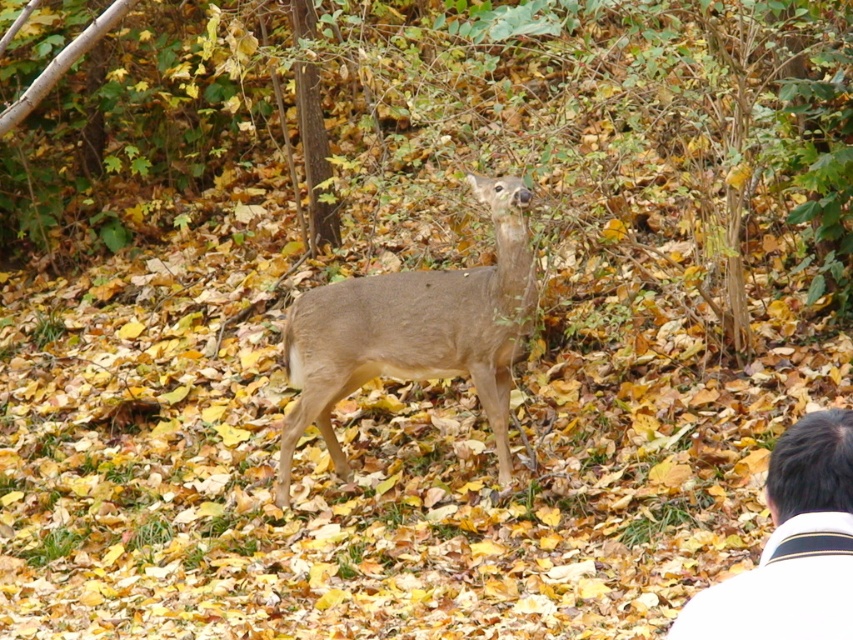
Does light brown fur at center have a lesser height compared to white shirt at lower right?

No.

Which is more to the right, light brown fur at center or white shirt at lower right?

white shirt at lower right is more to the right.

Where is `light brown fur at center`? light brown fur at center is located at coordinates (415, 332).